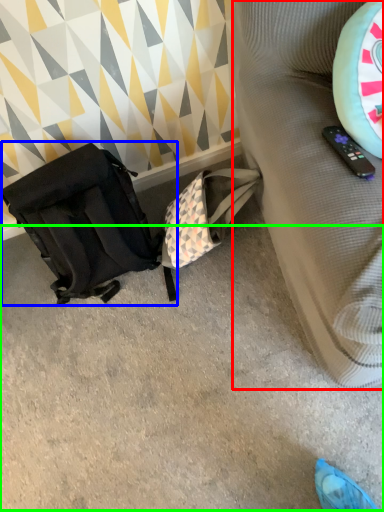
Question: Which object is the farthest from furniture (highlighted by a red box)? Choose among these: luggage and bags (highlighted by a blue box) or concrete (highlighted by a green box).

Choices:
 (A) luggage and bags
 (B) concrete

Answer: (A)